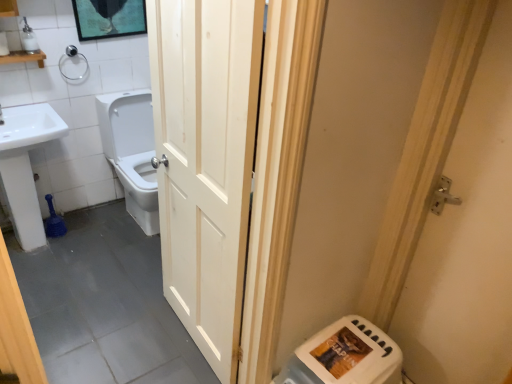
Where is `free point above white plastic water heater at lower right (from a real-world perspective)`? free point above white plastic water heater at lower right (from a real-world perspective) is located at coordinates (334, 354).